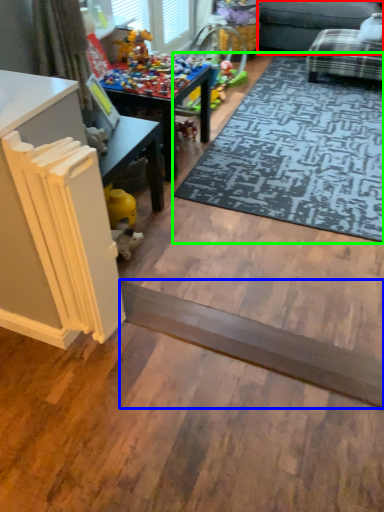
Question: Based on their relative distances, which object is farther from couch (highlighted by a red box)? Choose from plank (highlighted by a blue box) and mat (highlighted by a green box).

Choices:
 (A) plank
 (B) mat

Answer: (A)